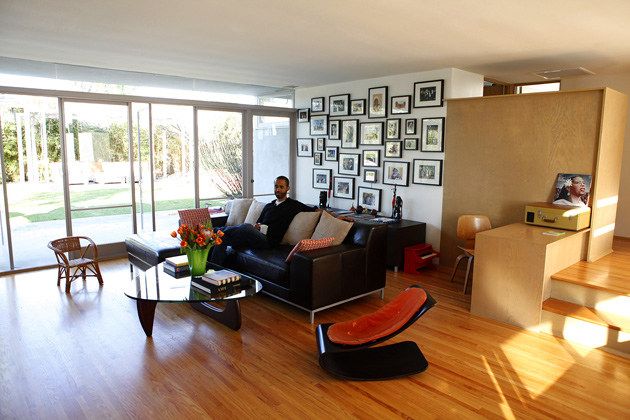
You are a GUI agent. You are given a task and a screenshot of the screen. Output one action in this format:
    pyautogui.click(x=<x>, y=<y>)
    Task: Click on the glass panels
    The image size is (630, 420).
    Given the screenshot: What is the action you would take?
    pyautogui.click(x=40, y=178), pyautogui.click(x=99, y=158), pyautogui.click(x=171, y=147), pyautogui.click(x=224, y=146), pyautogui.click(x=266, y=145)